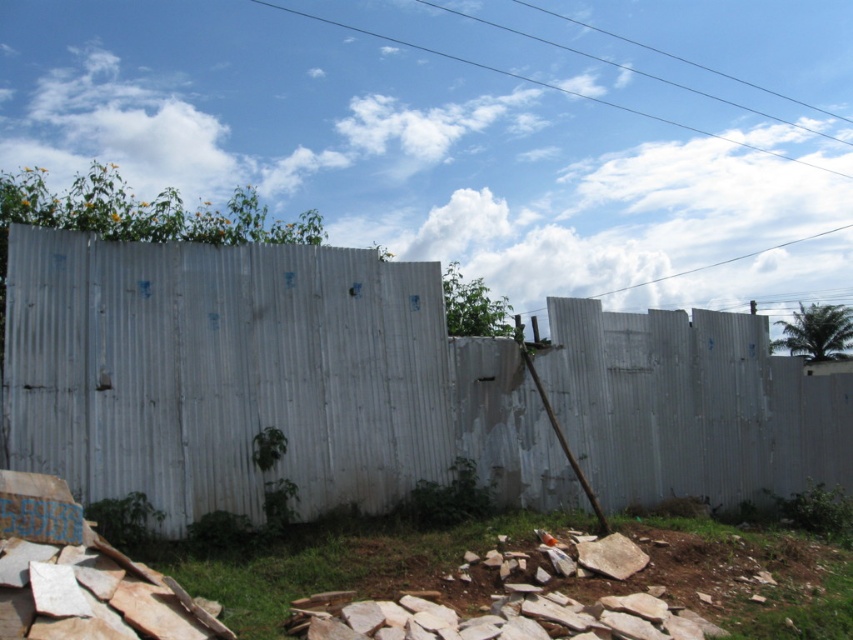
What do you see at coordinates (257, 378) in the screenshot? I see `white corrugated metal fence at center` at bounding box center [257, 378].

This screenshot has width=853, height=640. Find the location of `white corrugated metal fence at center`. white corrugated metal fence at center is located at coordinates (257, 378).